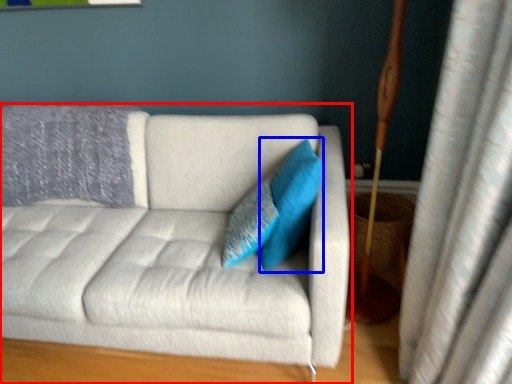
Question: Which object appears closest to the camera in this image, studio couch (highlighted by a red box) or pillow (highlighted by a blue box)?

Choices:
 (A) studio couch
 (B) pillow

Answer: (A)